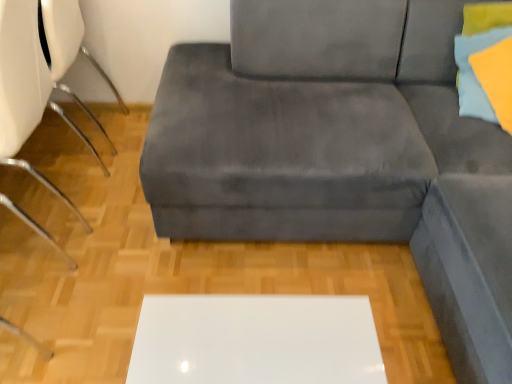
You are a GUI agent. You are given a task and a screenshot of the screen. Output one action in this format:
    pyautogui.click(x=<x>, y=<y>)
    Task: Click on the free point above velvet gray couch at center (from a real-world perspective)
    The width and height of the screenshot is (512, 384).
    Given the screenshot: What is the action you would take?
    pyautogui.click(x=157, y=238)